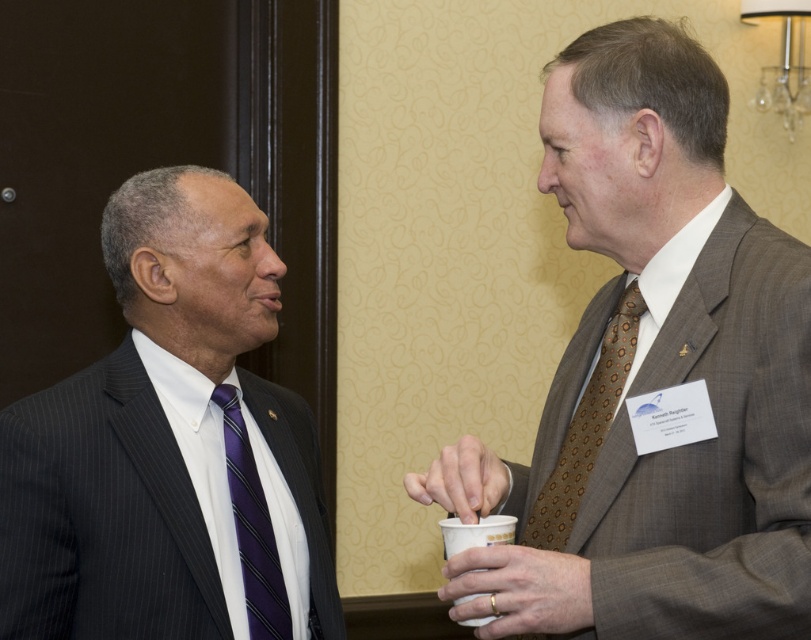
Question: From the image, what is the correct spatial relationship of matte black suit at left in relation to brown patterned tie at right?

Choices:
 (A) below
 (B) above

Answer: (A)

Question: Which object is farther from the camera taking this photo?

Choices:
 (A) purple striped tie at left
 (B) matte plastic cup at center
 (C) brown textured tie at right

Answer: (A)

Question: In this image, where is brown textured tie at right located relative to matte plastic cup at center?

Choices:
 (A) left
 (B) right

Answer: (B)

Question: Which object appears farthest from the camera in this image?

Choices:
 (A) white paper cup at lower center
 (B) matte black suit at left
 (C) matte plastic cup at center

Answer: (B)

Question: Is brown patterned tie at right above white paper cup at lower center?

Choices:
 (A) yes
 (B) no

Answer: (A)

Question: Which of the following is the closest to the observer?

Choices:
 (A) purple striped tie at left
 (B) white paper cup at lower center
 (C) brown patterned tie at right

Answer: (B)